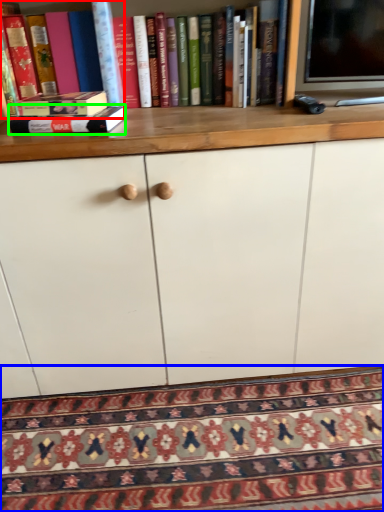
Question: Estimate the real-world distances between objects in this image. Which object is closer to book (highlighted by a red box), mat (highlighted by a blue box) or book (highlighted by a green box)?

Choices:
 (A) mat
 (B) book

Answer: (B)